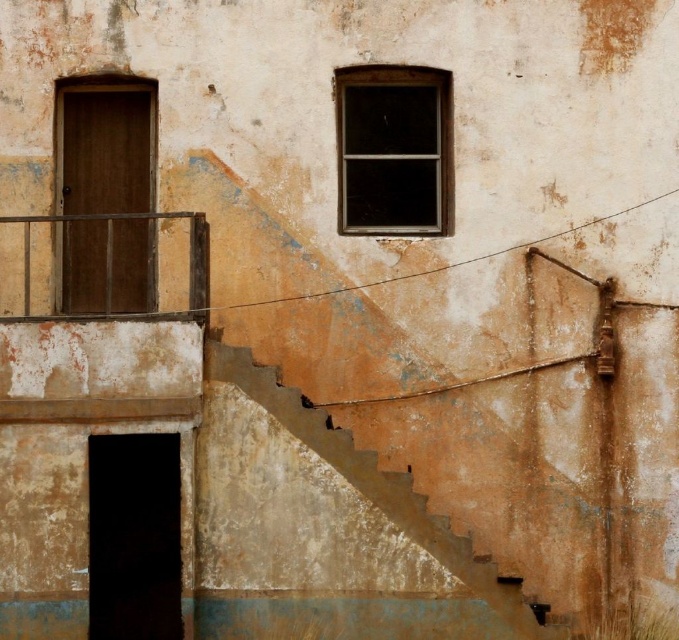
Between rusty concrete stairs at lower right and rusty metal balustrade at left, which one appears on the right side from the viewer's perspective?

From the viewer's perspective, rusty concrete stairs at lower right appears more on the right side.

Is rusty concrete stairs at lower right to the left of rusty metal balustrade at left from the viewer's perspective?

No, rusty concrete stairs at lower right is not to the left of rusty metal balustrade at left.

Image resolution: width=679 pixels, height=640 pixels. What are the coordinates of `rusty concrete stairs at lower right` in the screenshot? It's located at (375, 484).